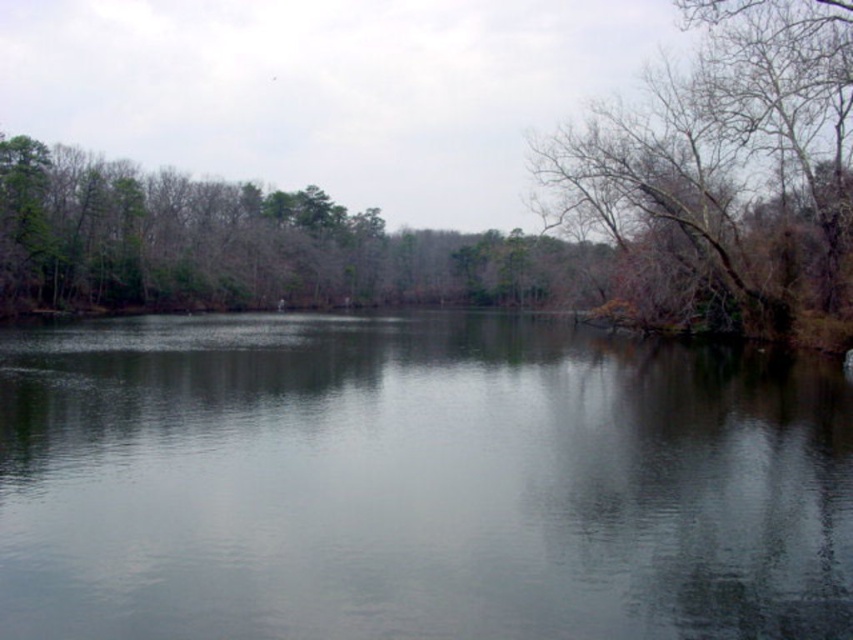
Can you confirm if smooth water at center is positioned below bare branches at right?

Correct, smooth water at center is located below bare branches at right.

Describe the element at coordinates (415, 483) in the screenshot. This screenshot has width=853, height=640. I see `smooth water at center` at that location.

Find the location of a particular element. Image resolution: width=853 pixels, height=640 pixels. smooth water at center is located at coordinates (415, 483).